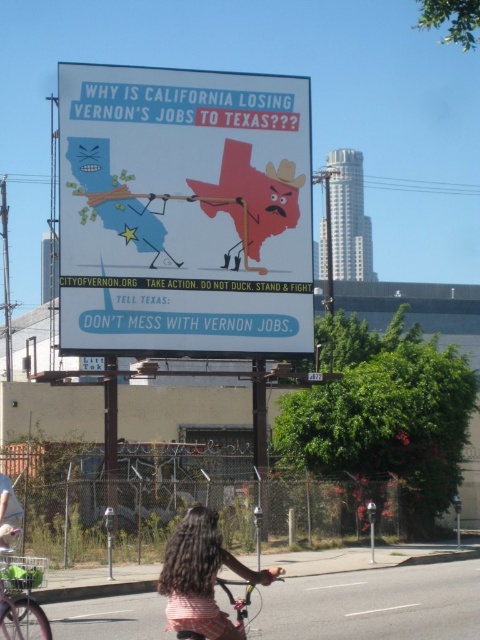
Between green matte bicycle at lower left and white plastic parking meter at lower right, which one has less height?

white plastic parking meter at lower right is shorter.

Who is lower down, green matte bicycle at lower left or white plastic parking meter at lower right?

Positioned lower is white plastic parking meter at lower right.

Does point (25, 582) come in front of point (371, 557)?

Yes, it is.

Find the location of a particular element. green matte bicycle at lower left is located at coordinates (21, 595).

Is matte blue paper at center taller than green matte bicycle at lower left?

In fact, matte blue paper at center may be shorter than green matte bicycle at lower left.

Is point (310, 193) behind point (19, 630)?

Yes, it is behind point (19, 630).

Image resolution: width=480 pixels, height=640 pixels. I want to click on matte blue paper at center, so click(183, 211).

I want to click on matte blue paper at center, so click(183, 211).

Who is higher up, metallic silver bicycle at lower center or white plastic parking meter at lower right?

Positioned higher is metallic silver bicycle at lower center.

Between metallic silver bicycle at lower center and white plastic parking meter at lower right, which one has less height?

white plastic parking meter at lower right is shorter.

Which is in front, point (240, 624) or point (374, 508)?

Point (240, 624)

Identify the location of metallic silver bicycle at lower center. (238, 600).